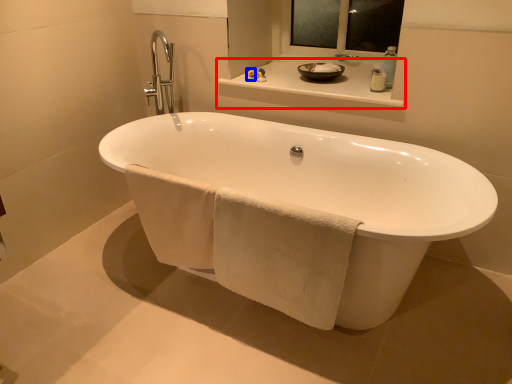
Question: Which point is further to the camera, counter top (highlighted by a red box) or toiletry (highlighted by a blue box)?

Choices:
 (A) counter top
 (B) toiletry

Answer: (B)